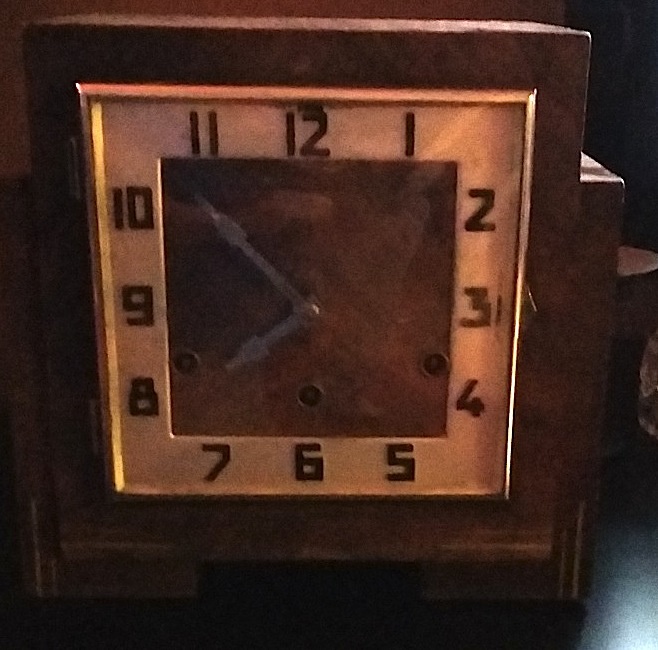
You are a GUI agent. You are given a task and a screenshot of the screen. Output one action in this format:
    pyautogui.click(x=<x>, y=<y>)
    Task: Click on the clock frame
    
    Given the screenshot: What is the action you would take?
    pyautogui.click(x=574, y=506), pyautogui.click(x=37, y=374), pyautogui.click(x=214, y=41)